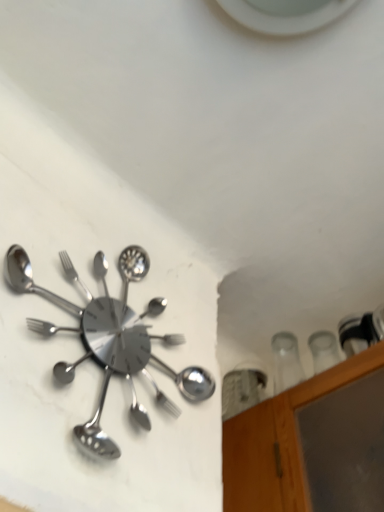
Question: Should I look upward or downward to see polished metal clock at upper left?

Choices:
 (A) down
 (B) up

Answer: (A)